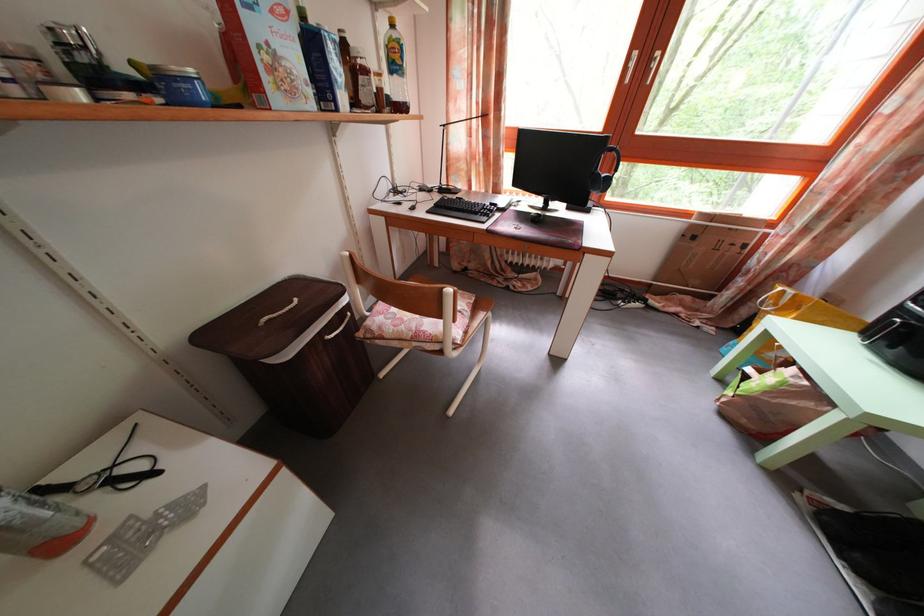
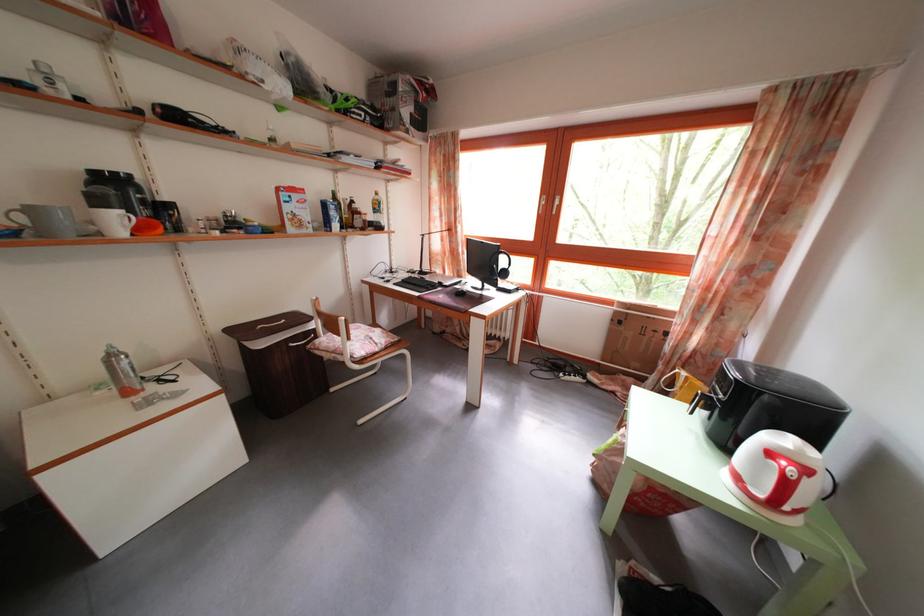
Question: The images are taken continuously from a first-person perspective. In which direction is your viewpoint rotating?

Choices:
 (A) Left
 (B) Right
 (C) Up
 (D) Down

Answer: (C)